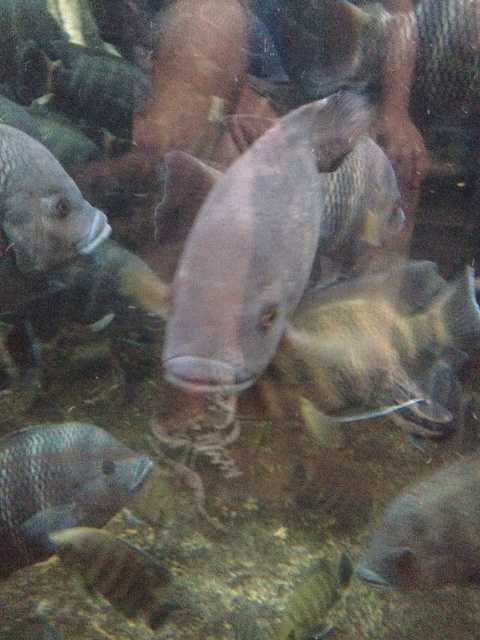
Does shiny silver fish at lower left have a lesser width compared to matte silver fish at upper left?

No.

Is shiny silver fish at lower left in front of matte silver fish at upper left?

No.

This screenshot has width=480, height=640. What are the coordinates of `shiny silver fish at lower left` in the screenshot? It's located at (60, 484).

This screenshot has height=640, width=480. Find the location of `shiny silver fish at lower left`. shiny silver fish at lower left is located at coordinates (60, 484).

Is brown striped rock at lower left closer to the viewer compared to shiny silver fish at center?

That is True.

Who is higher up, brown striped rock at lower left or shiny silver fish at center?

brown striped rock at lower left

I want to click on brown striped rock at lower left, so click(115, 572).

Is point (82, 483) more distant than point (323, 560)?

No, it is not.

Locate an element on the screen. The width and height of the screenshot is (480, 640). shiny silver fish at lower left is located at coordinates (60, 484).